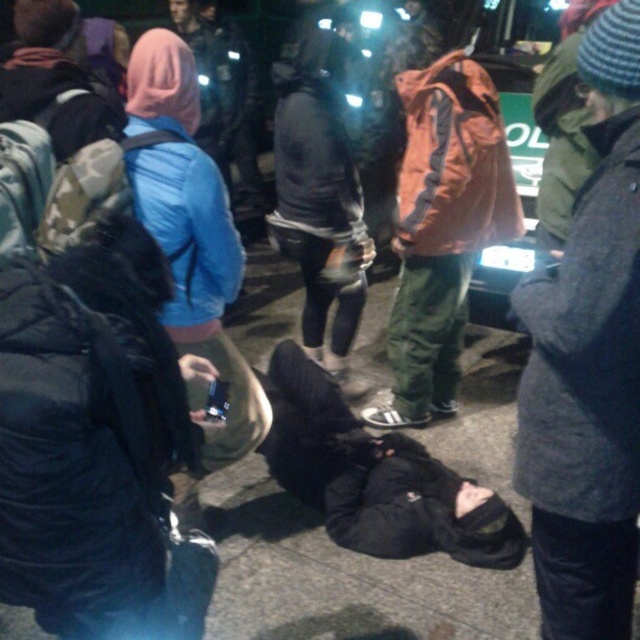
Question: Can you confirm if orange fabric jacket at center is positioned below blue fabric jacket at upper left?

Choices:
 (A) no
 (B) yes

Answer: (B)

Question: Considering the relative positions of orange fabric jacket at center and blue fabric jacket at upper left in the image provided, where is orange fabric jacket at center located with respect to blue fabric jacket at upper left?

Choices:
 (A) below
 (B) above

Answer: (A)

Question: Which of the following is the farthest from the observer?

Choices:
 (A) (228, 116)
 (B) (429, 106)

Answer: (A)

Question: Which point is closer to the camera taking this photo?

Choices:
 (A) (416, 408)
 (B) (173, 1)

Answer: (A)

Question: Among these points, which one is nearest to the camera?

Choices:
 (A) tap(225, 120)
 (B) tap(420, 417)

Answer: (B)

Question: Is orange fabric jacket at center to the right of blue fabric jacket at upper left from the viewer's perspective?

Choices:
 (A) yes
 (B) no

Answer: (A)